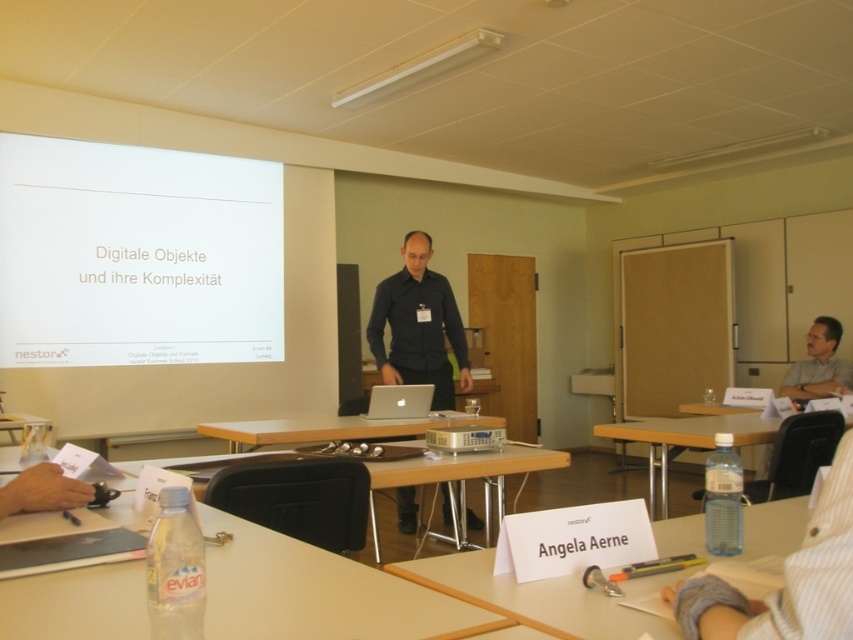
Question: Estimate the real-world distances between objects in this image. Which object is farther from the clear plastic water bottle at lower left?

Choices:
 (A) matte plastic table at lower left
 (B) wooden table at center
 (C) silver metallic laptop at center
 (D) matte gray shirt at right

Answer: (D)

Question: Considering the real-world distances, which object is farthest from the clear plastic water bottle at lower right?

Choices:
 (A) matte black shirt at center
 (B) white paper at center
 (C) white plastic projector at center
 (D) matte gray shirt at right

Answer: (B)

Question: Considering the relative positions of wooden table at center and matte gray shirt at right in the image provided, where is wooden table at center located with respect to matte gray shirt at right?

Choices:
 (A) above
 (B) below

Answer: (B)

Question: Does clear plastic water bottle at lower right lie in front of silver metallic laptop at center?

Choices:
 (A) no
 (B) yes

Answer: (B)

Question: Which of these objects is positioned farthest from the clear plastic water bottle at lower left?

Choices:
 (A) wooden table at center
 (B) matte plastic table at lower left

Answer: (B)

Question: Is matte black shirt at center above clear plastic water bottle at lower right?

Choices:
 (A) yes
 (B) no

Answer: (A)